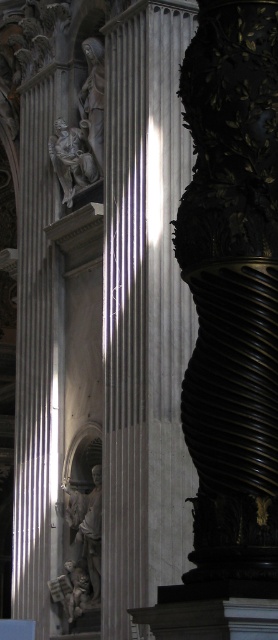
You are an architect examining the interior of a historical building. You notice the white marble column at center and the polished marble statue at upper center. Based on their heights, which one would require a taller ladder to clean? Please explain your reasoning.

The white marble column at center is much taller than the polished marble statue at upper center, so you would need a taller ladder to clean the white marble column at center.

You are an architect examining the column and the dark carved object in the image. You notice two points marked on the column and the carved object. Which of these points, point (112, 192) or point (87, 104), is nearer to you as you stand observing the scene?

Point (112, 192) is closer to the camera than point (87, 104), so the point at (112, 192) is nearer to you.